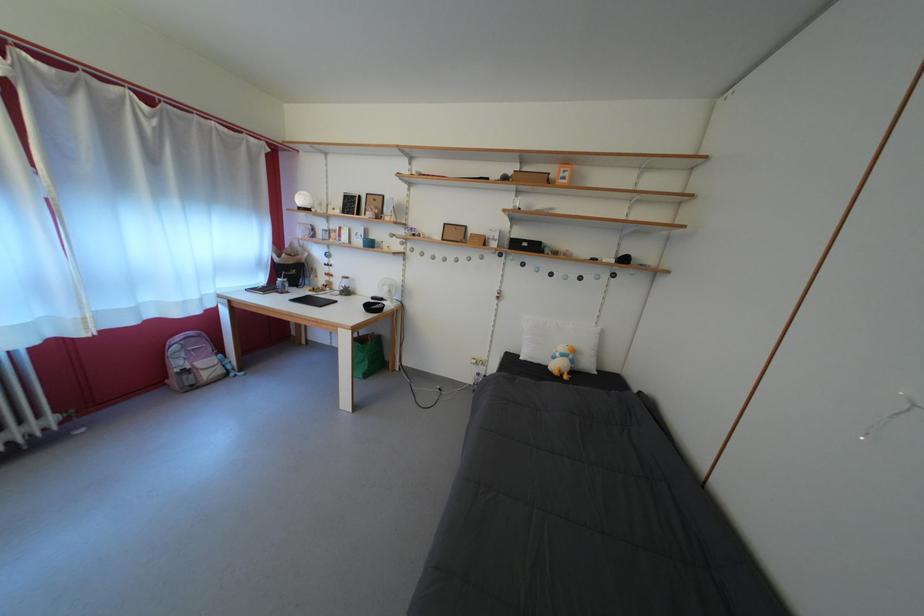
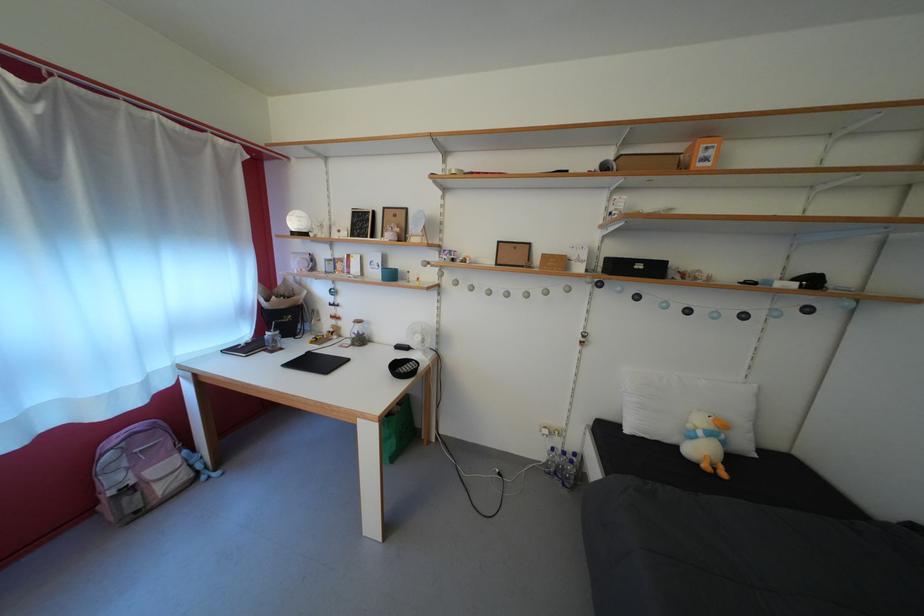
In the second image, find the point that corresponds to pixel 533 251 in the first image.

(648, 273)